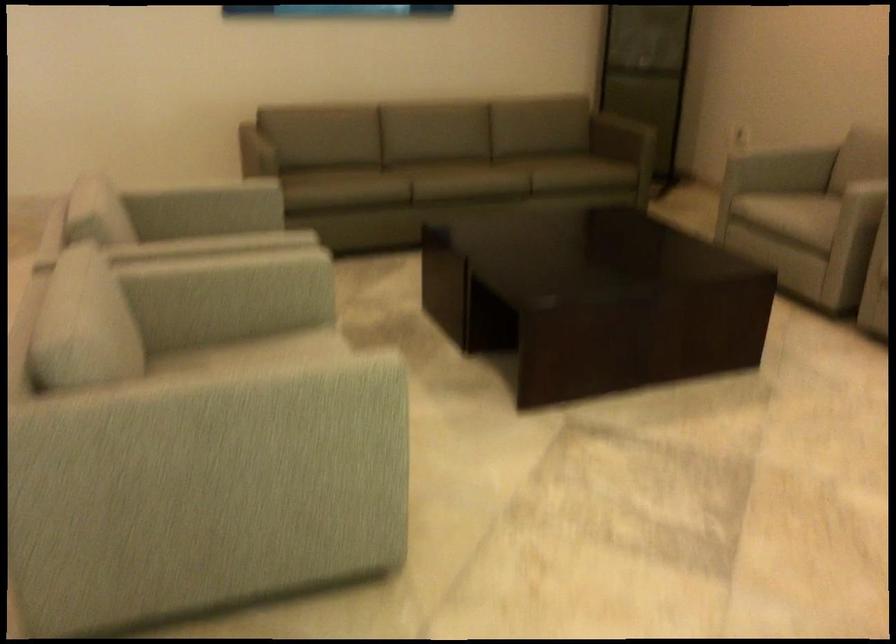
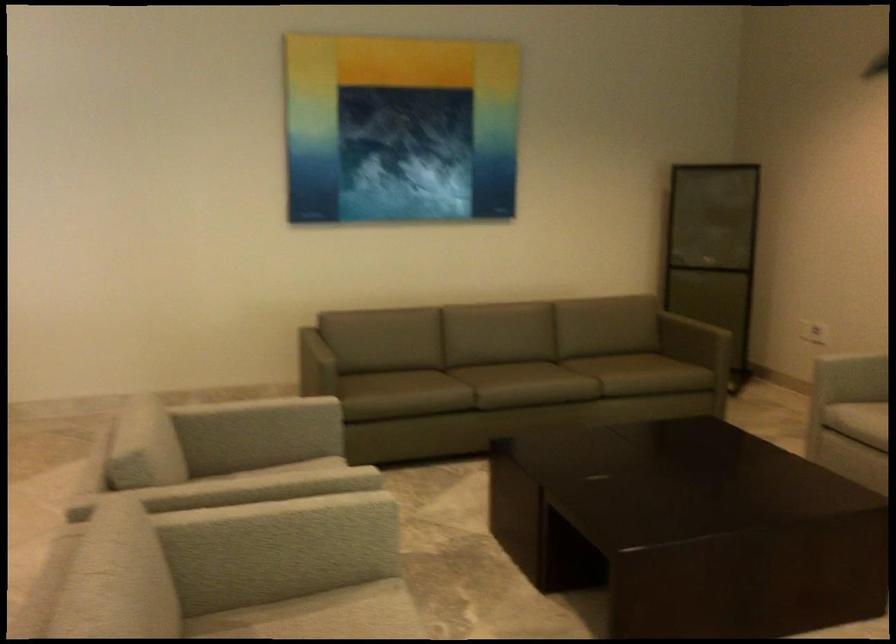
The point at (645, 124) is marked in the first image. Where is the corresponding point in the second image?

(713, 317)